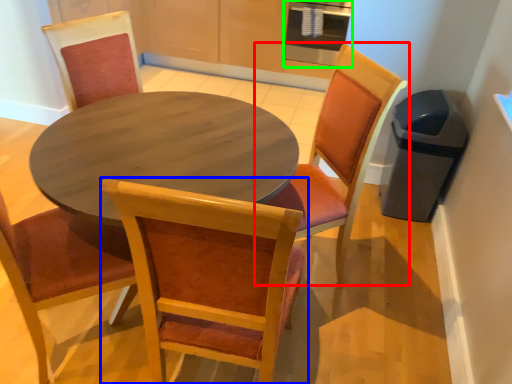
Question: Estimate the real-world distances between objects in this image. Which object is closer to chair (highlighted by a red box), chair (highlighted by a blue box) or appliance (highlighted by a green box)?

Choices:
 (A) chair
 (B) appliance

Answer: (A)